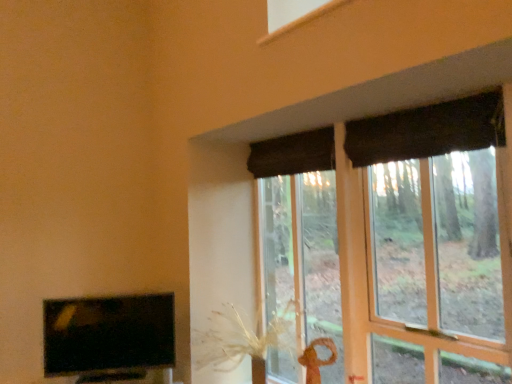
Describe the element at coordinates (110, 338) in the screenshot. The height and width of the screenshot is (384, 512). I see `matte black tv at lower left` at that location.

Identify the location of matte brown curtain at upper right. (437, 207).

Between point (505, 142) and point (433, 194), which one is positioned behind?

Point (433, 194)

In the scene shown: Is dark fabric curtain at upper right, acting as the 1th curtain starting from the right, positioned beyond the bounds of matte brown curtain at upper right?

That's incorrect, dark fabric curtain at upper right, acting as the 1th curtain starting from the right, is not completely outside matte brown curtain at upper right.

From a real-world perspective, is dark fabric curtain at upper right, marked as the second curtain in a left-to-right arrangement, above or below matte brown curtain at upper right?

From a real-world perspective, dark fabric curtain at upper right, marked as the second curtain in a left-to-right arrangement, is physically above matte brown curtain at upper right.

From the image's perspective, which one is positioned lower, matte brown curtain at upper right or dark fabric curtain at upper center, which is counted as the 1th curtain, starting from the back?

From the image's view, matte brown curtain at upper right is below.

Between matte brown curtain at upper right and dark fabric curtain at upper center, which ranks as the second curtain in right-to-left order, which one has larger size?

matte brown curtain at upper right.

Considering the relative positions of matte brown curtain at upper right and dark fabric curtain at upper center, the first curtain in the left-to-right sequence, in the image provided, is matte brown curtain at upper right to the left of dark fabric curtain at upper center, the first curtain in the left-to-right sequence, from the viewer's perspective?

Incorrect, matte brown curtain at upper right is not on the left side of dark fabric curtain at upper center, the first curtain in the left-to-right sequence.

Could you tell me if matte brown curtain at upper right is facing dark fabric curtain at upper center, the 2th curtain when ordered from front to back?

Yes, matte brown curtain at upper right is facing dark fabric curtain at upper center, the 2th curtain when ordered from front to back.

From the picture: Is dark fabric curtain at upper center, which is counted as the 1th curtain, starting from the back, taller than matte black tv at lower left?

In fact, dark fabric curtain at upper center, which is counted as the 1th curtain, starting from the back, may be shorter than matte black tv at lower left.

From the image's perspective, is dark fabric curtain at upper center, the first curtain in the left-to-right sequence, located beneath matte black tv at lower left?

Incorrect, from the image's perspective, dark fabric curtain at upper center, the first curtain in the left-to-right sequence, is higher than matte black tv at lower left.

Considering the sizes of objects dark fabric curtain at upper center, which is counted as the 1th curtain, starting from the back, and matte black tv at lower left in the image provided, who is bigger, dark fabric curtain at upper center, which is counted as the 1th curtain, starting from the back, or matte black tv at lower left?

With larger size is matte black tv at lower left.

Is matte black tv at lower left at the back of dark fabric curtain at upper center, the first curtain in the left-to-right sequence?

dark fabric curtain at upper center, the first curtain in the left-to-right sequence, does not have its back to matte black tv at lower left.

Can you confirm if dark fabric curtain at upper center, which is counted as the 1th curtain, starting from the back, is wider than matte brown curtain at upper right?

No, dark fabric curtain at upper center, which is counted as the 1th curtain, starting from the back, is not wider than matte brown curtain at upper right.

Looking at this image, from a real-world perspective, who is located lower, dark fabric curtain at upper center, the 2th curtain when ordered from front to back, or matte brown curtain at upper right?

matte brown curtain at upper right, from a real-world perspective.

How different are the orientations of dark fabric curtain at upper center, which ranks as the second curtain in right-to-left order, and matte brown curtain at upper right in degrees?

0.677 degrees.

From the image's perspective, is dark fabric curtain at upper center, which ranks as the second curtain in right-to-left order, above or below matte brown curtain at upper right?

Based on their image positions, dark fabric curtain at upper center, which ranks as the second curtain in right-to-left order, is located above matte brown curtain at upper right.

Is matte black tv at lower left located outside dark fabric curtain at upper right, placed as the 2th curtain when sorted from back to front?

Yes, matte black tv at lower left is located beyond the bounds of dark fabric curtain at upper right, placed as the 2th curtain when sorted from back to front.

From a real-world perspective, which is physically below, matte black tv at lower left or dark fabric curtain at upper right, acting as the 1th curtain starting from the right?

matte black tv at lower left, from a real-world perspective.

From the image's perspective, which is above, matte black tv at lower left or dark fabric curtain at upper right, placed as the 2th curtain when sorted from back to front?

dark fabric curtain at upper right, placed as the 2th curtain when sorted from back to front, appears higher in the image.

How different are the orientations of matte black tv at lower left and dark fabric curtain at upper right, marked as the second curtain in a left-to-right arrangement, in degrees?

The angular difference between matte black tv at lower left and dark fabric curtain at upper right, marked as the second curtain in a left-to-right arrangement, is 53.8 degrees.

Is matte brown curtain at upper right positioned beyond the bounds of dark fabric curtain at upper right, marked as the second curtain in a left-to-right arrangement?

Yes.

Is matte brown curtain at upper right in front of or behind dark fabric curtain at upper right, placed as the 2th curtain when sorted from back to front, in the image?

matte brown curtain at upper right is positioned closer to the viewer than dark fabric curtain at upper right, placed as the 2th curtain when sorted from back to front.

Looking at this image, considering the relative sizes of matte brown curtain at upper right and dark fabric curtain at upper right, placed as the 2th curtain when sorted from back to front, in the image provided, is matte brown curtain at upper right bigger than dark fabric curtain at upper right, placed as the 2th curtain when sorted from back to front,?

Yes.

Measure the distance from dark fabric curtain at upper center, which is counted as the 1th curtain, starting from the back, to dark fabric curtain at upper right, marked as the second curtain in a left-to-right arrangement.

dark fabric curtain at upper center, which is counted as the 1th curtain, starting from the back, is 13.52 centimeters from dark fabric curtain at upper right, marked as the second curtain in a left-to-right arrangement.

Considering the relative positions of dark fabric curtain at upper center, the 2th curtain when ordered from front to back, and dark fabric curtain at upper right, marked as the second curtain in a left-to-right arrangement, in the image provided, is dark fabric curtain at upper center, the 2th curtain when ordered from front to back, behind dark fabric curtain at upper right, marked as the second curtain in a left-to-right arrangement,?

A: Yes, dark fabric curtain at upper center, the 2th curtain when ordered from front to back, is behind dark fabric curtain at upper right, marked as the second curtain in a left-to-right arrangement.

Based on the photo, from a real-world perspective, is dark fabric curtain at upper center, which ranks as the second curtain in right-to-left order, under dark fabric curtain at upper right, marked as the second curtain in a left-to-right arrangement?

No, from a real-world perspective, dark fabric curtain at upper center, which ranks as the second curtain in right-to-left order, is not under dark fabric curtain at upper right, marked as the second curtain in a left-to-right arrangement.

Based on the photo, can you confirm if dark fabric curtain at upper center, which ranks as the second curtain in right-to-left order, is smaller than dark fabric curtain at upper right, acting as the 1th curtain starting from the right?

Correct, dark fabric curtain at upper center, which ranks as the second curtain in right-to-left order, occupies less space than dark fabric curtain at upper right, acting as the 1th curtain starting from the right.

This screenshot has height=384, width=512. I want to click on window below the dark fabric curtain at upper right, acting as the 1th curtain starting from the right (from the image's perspective), so click(437, 207).

In the image, there is a dark fabric curtain at upper center, the first curtain in the left-to-right sequence. Where is `window below it (from a real-world perspective)`? This screenshot has height=384, width=512. window below it (from a real-world perspective) is located at coordinates (437, 207).

When comparing their distances from matte brown curtain at upper right, does matte black tv at lower left or dark fabric curtain at upper center, which is counted as the 1th curtain, starting from the back, seem closer?

dark fabric curtain at upper center, which is counted as the 1th curtain, starting from the back, is positioned closer to the anchor matte brown curtain at upper right.

Consider the image. From the image, which object appears to be nearer to dark fabric curtain at upper center, which is counted as the 1th curtain, starting from the back, matte black tv at lower left or dark fabric curtain at upper right, acting as the 1th curtain starting from the right?

dark fabric curtain at upper right, acting as the 1th curtain starting from the right, lies closer to dark fabric curtain at upper center, which is counted as the 1th curtain, starting from the back, than the other object.

Based on their spatial positions, is matte brown curtain at upper right or dark fabric curtain at upper center, the 2th curtain when ordered from front to back, further from dark fabric curtain at upper right, the first curtain viewed from the front?

Based on the image, matte brown curtain at upper right appears to be further to dark fabric curtain at upper right, the first curtain viewed from the front.

Based on their spatial positions, is dark fabric curtain at upper right, marked as the second curtain in a left-to-right arrangement, or matte brown curtain at upper right closer to matte black tv at lower left?

dark fabric curtain at upper right, marked as the second curtain in a left-to-right arrangement, is positioned closer to the anchor matte black tv at lower left.

From the image, which object appears to be nearer to matte black tv at lower left, matte brown curtain at upper right or dark fabric curtain at upper right, the first curtain viewed from the front?

dark fabric curtain at upper right, the first curtain viewed from the front, is positioned closer to the anchor matte black tv at lower left.

Considering their positions, is dark fabric curtain at upper right, marked as the second curtain in a left-to-right arrangement, positioned closer to matte brown curtain at upper right than matte black tv at lower left?

Among the two, dark fabric curtain at upper right, marked as the second curtain in a left-to-right arrangement, is located nearer to matte brown curtain at upper right.

Based on their spatial positions, is dark fabric curtain at upper center, the 2th curtain when ordered from front to back, or matte brown curtain at upper right further from matte black tv at lower left?

Among the two, matte brown curtain at upper right is located further to matte black tv at lower left.

Considering their positions, is dark fabric curtain at upper center, which is counted as the 1th curtain, starting from the back, positioned further to matte black tv at lower left than dark fabric curtain at upper right, marked as the second curtain in a left-to-right arrangement?

dark fabric curtain at upper right, marked as the second curtain in a left-to-right arrangement, lies further to matte black tv at lower left than the other object.

At what (x,y) coordinates should I click in order to perform the action: click on window between matte black tv at lower left and dark fabric curtain at upper right, the first curtain viewed from the front. Please return your answer as a coordinate pair (x, y). This screenshot has width=512, height=384. Looking at the image, I should click on tap(437, 207).

Find the location of a particular element. The height and width of the screenshot is (384, 512). curtain situated between matte black tv at lower left and matte brown curtain at upper right from left to right is located at coordinates (293, 154).

What are the coordinates of `curtain positioned between matte brown curtain at upper right and dark fabric curtain at upper center, which is counted as the 1th curtain, starting from the back, from near to far` in the screenshot? It's located at (426, 130).

Where is `curtain between matte black tv at lower left and dark fabric curtain at upper right, placed as the 2th curtain when sorted from back to front, from left to right`? curtain between matte black tv at lower left and dark fabric curtain at upper right, placed as the 2th curtain when sorted from back to front, from left to right is located at coordinates (293, 154).